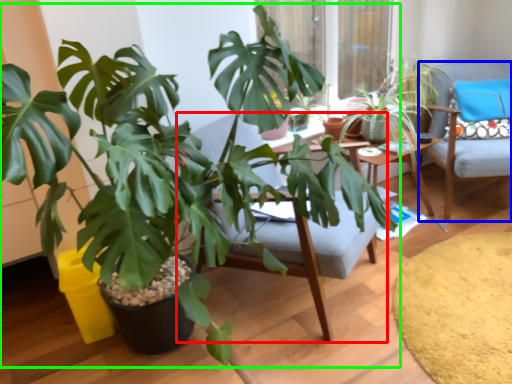
Question: Considering the real-world distances, which object is farthest from swivel chair (highlighted by a red box)? chair (highlighted by a blue box) or houseplant (highlighted by a green box)?

Choices:
 (A) chair
 (B) houseplant

Answer: (A)